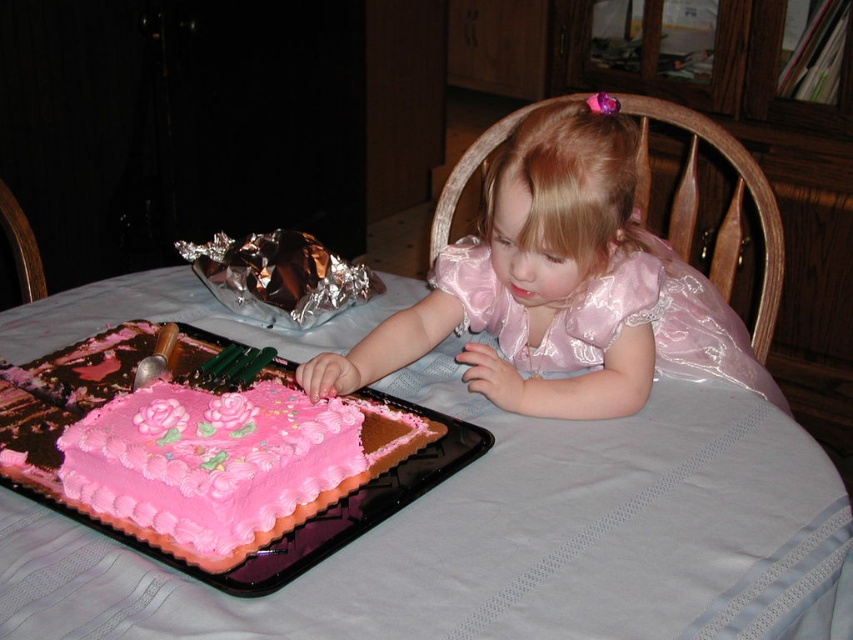
You are a guest at a birthday party and see the pink frosted cake at lower left on the table. The host asks you to place a small candle exactly at point (160, 538). Is this possible?

The point (160, 538) is occupied by the pink frosted cake at lower left, so placing a candle there is not possible.

You are a photographer trying to capture the pink satin dress at center and the pink shiny dress at upper center in a single shot. Which dress will appear larger in the photo?

The pink satin dress at center will appear larger in the photo because it is closer to the viewer than the pink shiny dress at upper center.

You are a photographer trying to capture the shiny metallic foil at center without the pink shiny dress at upper center blocking it. What should you adjust in your camera angle?

The pink shiny dress at upper center is in front of the shiny metallic foil at center, so you should move your camera angle to the side or lower it to avoid the dress blocking the view of the foil.